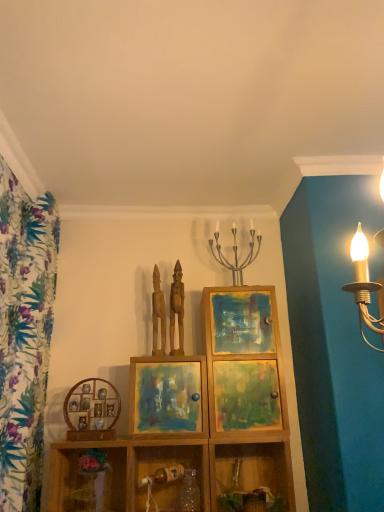
Question: From the image's perspective, is wooden shelf at lower right, which is the fourth shelf in left-to-right order, over matte wooden picture frame at center, the second picture frame when ordered from left to right?

Choices:
 (A) no
 (B) yes

Answer: (A)

Question: From a real-world perspective, is wooden shelf at lower right, which is the first shelf from right to left, under matte wooden picture frame at center, arranged as the 1th picture frame when viewed from the right?

Choices:
 (A) no
 (B) yes

Answer: (B)

Question: Is the depth of wooden shelf at lower right, which is the fourth shelf in left-to-right order, less than that of matte wooden picture frame at center, arranged as the 1th picture frame when viewed from the right?

Choices:
 (A) yes
 (B) no

Answer: (A)

Question: Can you confirm if wooden shelf at lower right, which is the first shelf from right to left, is taller than matte wooden picture frame at center, arranged as the 1th picture frame when viewed from the right?

Choices:
 (A) no
 (B) yes

Answer: (B)

Question: Is wooden shelf at lower right, which is the first shelf from right to left, surrounding matte wooden picture frame at center, arranged as the 1th picture frame when viewed from the right?

Choices:
 (A) yes
 (B) no

Answer: (B)

Question: Is there a large distance between wooden shelf at lower right, which is the first shelf from right to left, and matte wooden picture frame at center, arranged as the 1th picture frame when viewed from the right?

Choices:
 (A) yes
 (B) no

Answer: (B)

Question: From the image's perspective, is wooden picture frame at center-left, the 2th picture frame viewed from the right, on top of wooden shelf at lower center, which appears as the third shelf when viewed from the left?

Choices:
 (A) yes
 (B) no

Answer: (A)

Question: Is wooden picture frame at center-left, positioned as the first picture frame in left-to-right order, behind wooden shelf at lower center, which ranks as the second shelf in right-to-left order?

Choices:
 (A) no
 (B) yes

Answer: (B)

Question: Does wooden picture frame at center-left, the 2th picture frame viewed from the right, have a greater width compared to wooden shelf at lower center, which ranks as the second shelf in right-to-left order?

Choices:
 (A) yes
 (B) no

Answer: (B)

Question: From the image's perspective, is wooden picture frame at center-left, the 2th picture frame viewed from the right, below wooden shelf at lower center, which ranks as the second shelf in right-to-left order?

Choices:
 (A) no
 (B) yes

Answer: (A)

Question: Is wooden picture frame at center-left, the 2th picture frame viewed from the right, oriented away from wooden shelf at lower center, which appears as the third shelf when viewed from the left?

Choices:
 (A) no
 (B) yes

Answer: (A)

Question: Could you tell me if wooden picture frame at center-left, positioned as the first picture frame in left-to-right order, is facing wooden shelf at lower center, which appears as the third shelf when viewed from the left?

Choices:
 (A) yes
 (B) no

Answer: (B)

Question: From the image's perspective, is wooden statue at center, which appears as the 1th sculpture when viewed from the right, above metallic candle holder at center?

Choices:
 (A) no
 (B) yes

Answer: (A)